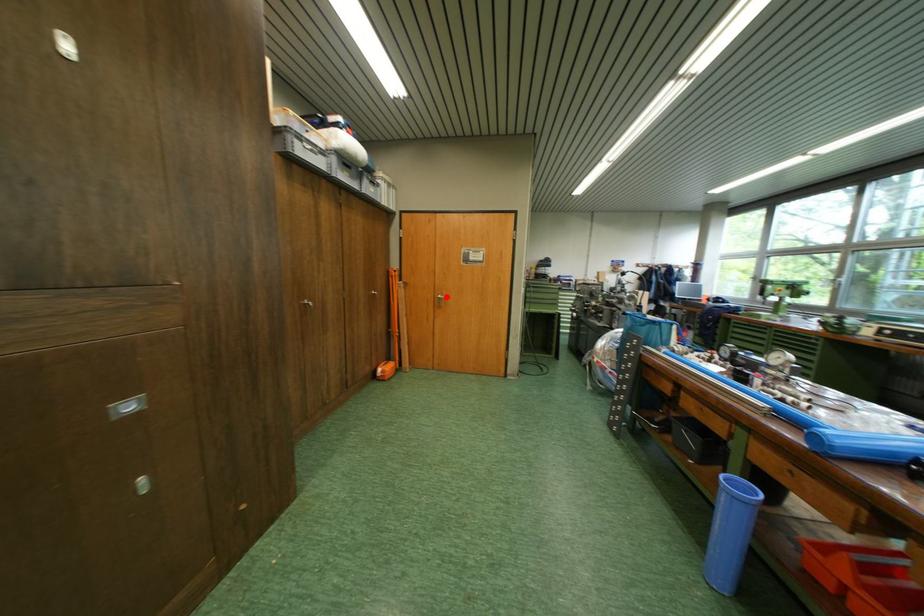
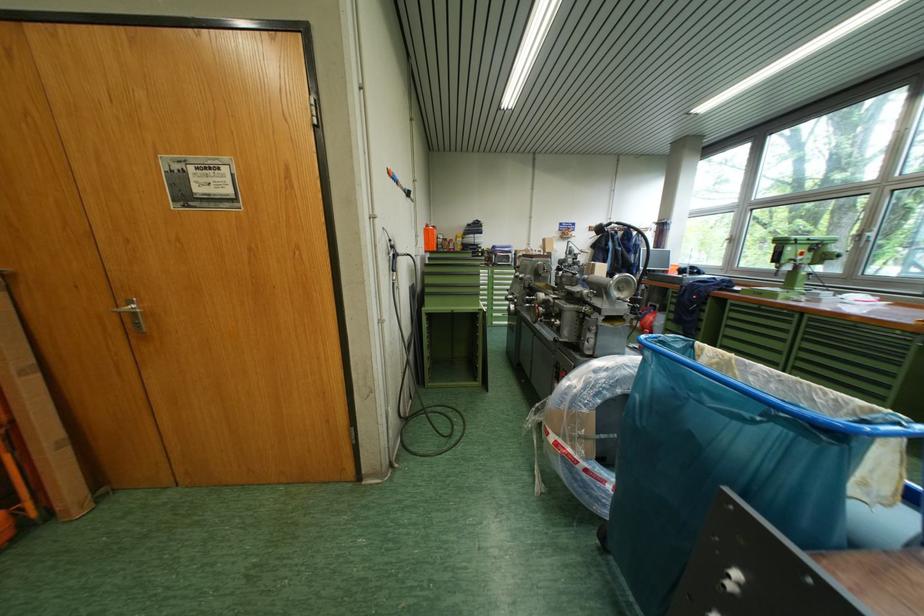
The point at the highlighted location is marked in the first image. Where is the corresponding point in the second image?

(131, 305)